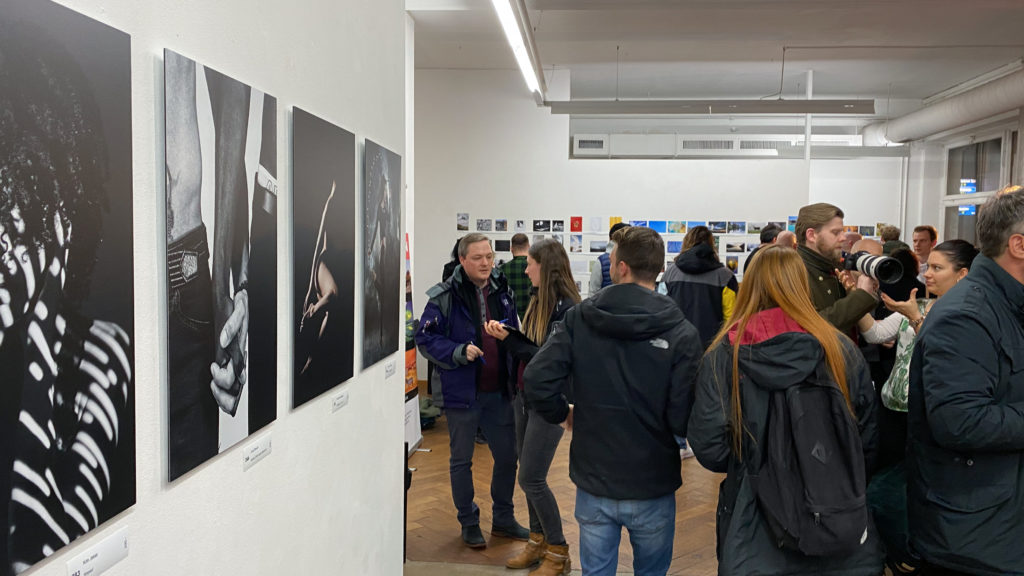
Image resolution: width=1024 pixels, height=576 pixels. I want to click on grey back wall, so click(x=475, y=151), click(x=660, y=181), click(x=849, y=187).